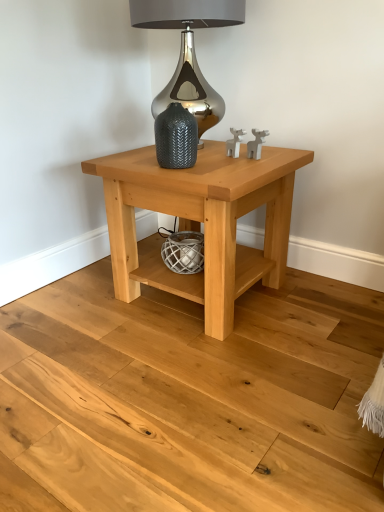
Find the location of a particular element. The width and height of the screenshot is (384, 512). free space to the left of natural wood table at center is located at coordinates (69, 314).